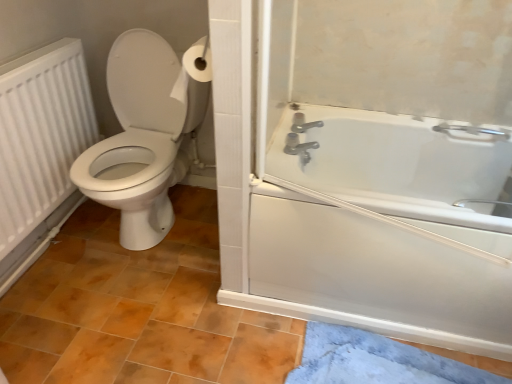
The image size is (512, 384). I want to click on white plastic bathtub at right, so click(385, 168).

What do you see at coordinates (41, 134) in the screenshot? The height and width of the screenshot is (384, 512). I see `white matte radiator at left` at bounding box center [41, 134].

The width and height of the screenshot is (512, 384). What do you see at coordinates (139, 309) in the screenshot?
I see `brown matte tile at lower center` at bounding box center [139, 309].

This screenshot has height=384, width=512. What are the coordinates of `white plastic bathtub at right` in the screenshot? It's located at (385, 168).

Considering the sizes of brown matte tile at lower center and blue plush bath mat at lower right in the image, is brown matte tile at lower center taller or shorter than blue plush bath mat at lower right?

In the image, brown matte tile at lower center appears to be taller than blue plush bath mat at lower right.

Which is correct: brown matte tile at lower center is inside blue plush bath mat at lower right, or outside of it?

brown matte tile at lower center is outside blue plush bath mat at lower right.

The width and height of the screenshot is (512, 384). Identify the location of tile that is above the blue plush bath mat at lower right (from a real-world perspective). [139, 309].

Considering the positions of objects brown matte tile at lower center and blue plush bath mat at lower right in the image provided, who is behind, brown matte tile at lower center or blue plush bath mat at lower right?

blue plush bath mat at lower right is behind.

Is point (62, 132) positioned behind point (332, 378)?

Yes, it is behind point (332, 378).

Is white matte radiator at left thinner than blue plush bath mat at lower right?

Yes.

From the image's perspective, would you say white matte radiator at left is positioned over blue plush bath mat at lower right?

Yes, from the image's perspective, white matte radiator at left is above blue plush bath mat at lower right.

How far apart are white matte radiator at left and blue plush bath mat at lower right?

1.32 meters.

From the image's perspective, relative to brown matte tile at lower center, is white matte radiator at left above or below?

From the image's perspective, white matte radiator at left appears above brown matte tile at lower center.

Considering the relative sizes of white matte radiator at left and brown matte tile at lower center in the image provided, is white matte radiator at left smaller than brown matte tile at lower center?

Correct, white matte radiator at left occupies less space than brown matte tile at lower center.

Between point (19, 104) and point (127, 366), which one is positioned behind?

The point (19, 104) is behind.

From a real-world perspective, which is physically above, white matte radiator at left or brown matte tile at lower center?

white matte radiator at left is physically above.

From the image's perspective, relative to white matte radiator at left, is white glossy toilet at left above or below?

From the image's perspective, white glossy toilet at left appears above white matte radiator at left.

Which point is more distant from viewer, (x=152, y=80) or (x=23, y=224)?

The point (x=152, y=80) is behind.

Is white glossy toilet at left inside or outside of white matte radiator at left?

white glossy toilet at left exists outside the volume of white matte radiator at left.

From a real-world perspective, is white glossy toilet at left under white matte radiator at left?

Yes, from a real-world perspective, white glossy toilet at left is below white matte radiator at left.

In the scene shown: Is white plastic bathtub at right bigger than blue plush bath mat at lower right?

Correct, white plastic bathtub at right is larger in size than blue plush bath mat at lower right.

Is white plastic bathtub at right facing away from blue plush bath mat at lower right?

No, blue plush bath mat at lower right is not at the back of white plastic bathtub at right.

Which object is positioned more to the left, white plastic bathtub at right or blue plush bath mat at lower right?

Positioned to the left is white plastic bathtub at right.

Is point (381, 219) closer to viewer compared to point (432, 381)?

Yes, it is in front of point (432, 381).

Is brown matte tile at lower center completely or partially inside white plastic bathtub at right?

No, brown matte tile at lower center is located outside of white plastic bathtub at right.

Can you confirm if white plastic bathtub at right is thinner than brown matte tile at lower center?

Yes.

From the image's perspective, is white plastic bathtub at right on brown matte tile at lower center?

Yes, from the image's perspective, white plastic bathtub at right is over brown matte tile at lower center.

Is white plastic bathtub at right facing towards brown matte tile at lower center?

No, white plastic bathtub at right does not turn towards brown matte tile at lower center.

Is point (338, 165) closer or farther from the camera than point (95, 181)?

Point (338, 165) appears to be farther away from the viewer than point (95, 181).

Is white plastic bathtub at right surrounding white glossy toilet at left?

No, white glossy toilet at left is not a part of white plastic bathtub at right.

Which object is positioned more to the left, white plastic bathtub at right or white glossy toilet at left?

white glossy toilet at left is more to the left.

Which of these two, white plastic bathtub at right or white glossy toilet at left, stands shorter?

white plastic bathtub at right is shorter.

The height and width of the screenshot is (384, 512). Find the location of `tile above the blue plush bath mat at lower right (from a real-world perspective)`. tile above the blue plush bath mat at lower right (from a real-world perspective) is located at coordinates (139, 309).

Find the location of `radiator located above the blue plush bath mat at lower right (from the image's perspective)`. radiator located above the blue plush bath mat at lower right (from the image's perspective) is located at coordinates (41, 134).

Based on their spatial positions, is white plastic bathtub at right or blue plush bath mat at lower right further from white matte radiator at left?

blue plush bath mat at lower right is further to white matte radiator at left.

From the image, which object appears to be nearer to white matte radiator at left, blue plush bath mat at lower right or brown matte tile at lower center?

brown matte tile at lower center lies closer to white matte radiator at left than the other object.

Based on their spatial positions, is white matte radiator at left or white glossy toilet at left closer to white plastic bathtub at right?

white glossy toilet at left.

From the image, which object appears to be nearer to white matte radiator at left, white glossy toilet at left or blue plush bath mat at lower right?

white glossy toilet at left.

When comparing their distances from blue plush bath mat at lower right, does white plastic bathtub at right or brown matte tile at lower center seem closer?

white plastic bathtub at right is closer to blue plush bath mat at lower right.

From the picture: Considering their positions, is white glossy toilet at left positioned further to blue plush bath mat at lower right than white plastic bathtub at right?

white glossy toilet at left lies further to blue plush bath mat at lower right than the other object.

Which object lies nearer to the anchor point blue plush bath mat at lower right, white plastic bathtub at right or white matte radiator at left?

Based on the image, white plastic bathtub at right appears to be nearer to blue plush bath mat at lower right.

Looking at the image, which one is located closer to blue plush bath mat at lower right, brown matte tile at lower center or white glossy toilet at left?

brown matte tile at lower center is positioned closer to the anchor blue plush bath mat at lower right.

Find the location of a particular element. The image size is (512, 384). tile between white glossy toilet at left and blue plush bath mat at lower right is located at coordinates (139, 309).

Image resolution: width=512 pixels, height=384 pixels. I want to click on screen door between white matte radiator at left and blue plush bath mat at lower right in the horizontal direction, so click(385, 168).

This screenshot has height=384, width=512. Find the location of `toilet located between white matte radiator at left and white plastic bathtub at right in the left-right direction`. toilet located between white matte radiator at left and white plastic bathtub at right in the left-right direction is located at coordinates (146, 132).

This screenshot has width=512, height=384. Find the location of `toilet located between white matte radiator at left and brown matte tile at lower center in the left-right direction`. toilet located between white matte radiator at left and brown matte tile at lower center in the left-right direction is located at coordinates pyautogui.click(x=146, y=132).